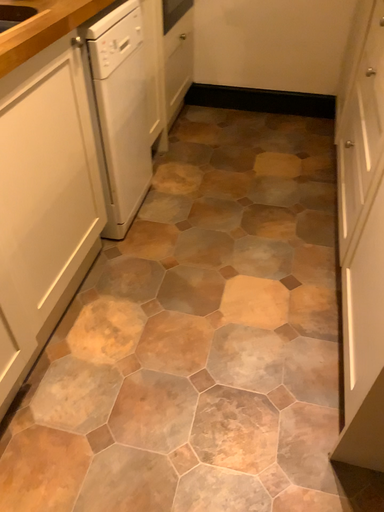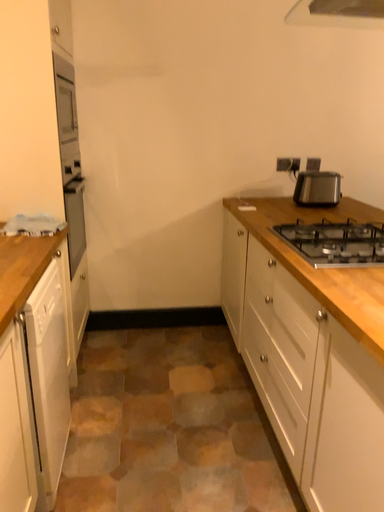
Question: How did the camera likely rotate when shooting the video?

Choices:
 (A) rotated right
 (B) rotated left

Answer: (A)